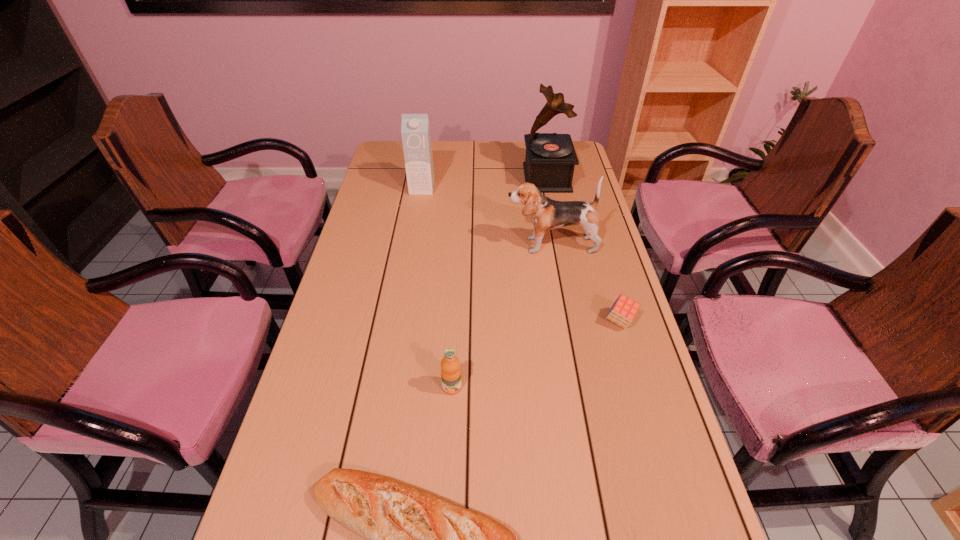
This screenshot has height=540, width=960. I want to click on object that is the third closest to the puppy, so click(x=415, y=128).

Identify the location of the fifth closest object to the orange juice. The width and height of the screenshot is (960, 540). 550,159.

Locate an element on the screen. free location that satisfies the following two spatial constraints: 1. at the horn opening of the phonograph_record; 2. on the label of the orange juice is located at coordinates (589, 387).

Locate an element on the screen. This screenshot has width=960, height=540. vacant space that satisfies the following two spatial constraints: 1. at the horn opening of the tallest object; 2. on the front label of the carton is located at coordinates (549, 188).

This screenshot has width=960, height=540. In order to click on free spot that satisfies the following two spatial constraints: 1. at the face of the puppy; 2. on the label of the orange juice in this screenshot , I will do `click(577, 387)`.